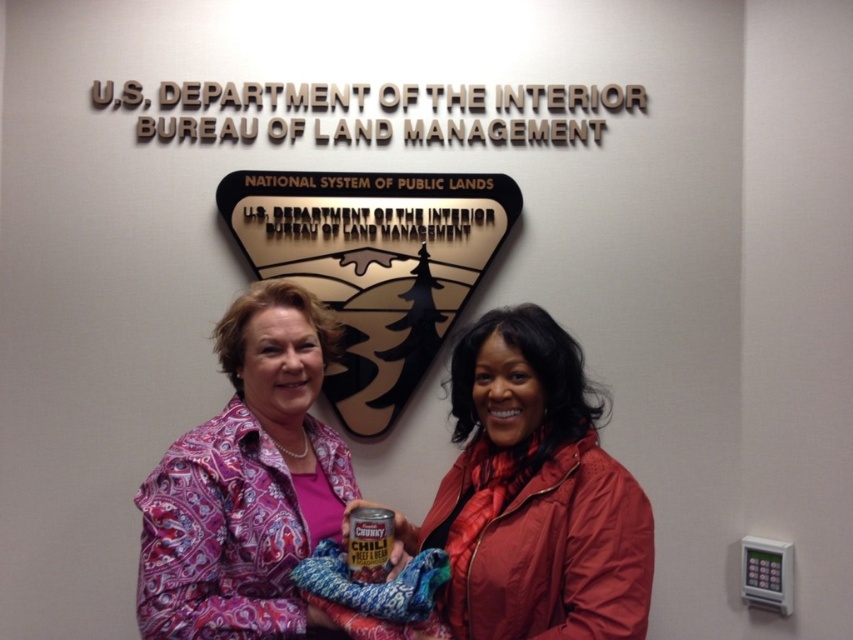
Question: Considering the relative positions of red matte jacket at center and pink paisley shirt at center in the image provided, where is red matte jacket at center located with respect to pink paisley shirt at center?

Choices:
 (A) below
 (B) above

Answer: (A)

Question: Among these points, which one is nearest to the camera?

Choices:
 (A) (231, 602)
 (B) (450, 611)

Answer: (A)

Question: Which point is closer to the camera?

Choices:
 (A) red matte jacket at center
 (B) pink paisley shirt at center

Answer: (A)

Question: Can you confirm if red matte jacket at center is positioned to the right of pink paisley shirt at center?

Choices:
 (A) yes
 (B) no

Answer: (A)

Question: Can you confirm if red matte jacket at center is smaller than pink paisley shirt at center?

Choices:
 (A) yes
 (B) no

Answer: (A)